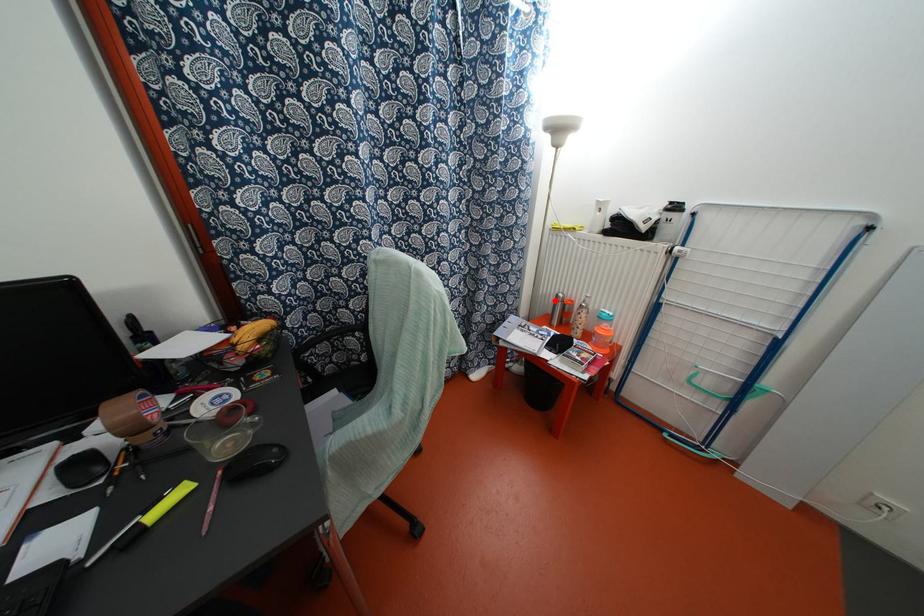
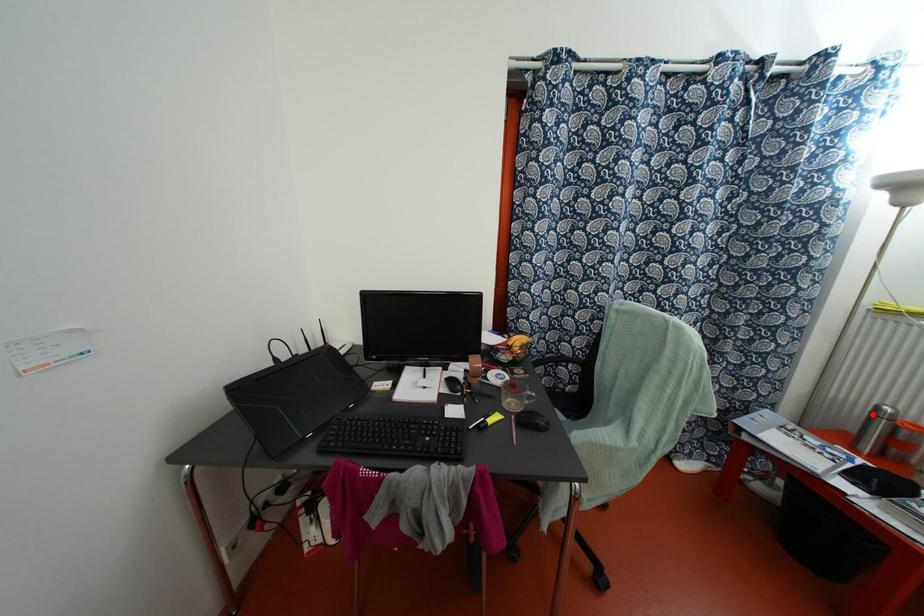
I am providing you with two images of the same scene from different viewpoints. A red point is marked on the first image and another point is marked on the second image. Do the highlighted points in image1 and image2 indicate the same real-world spot?

Yes